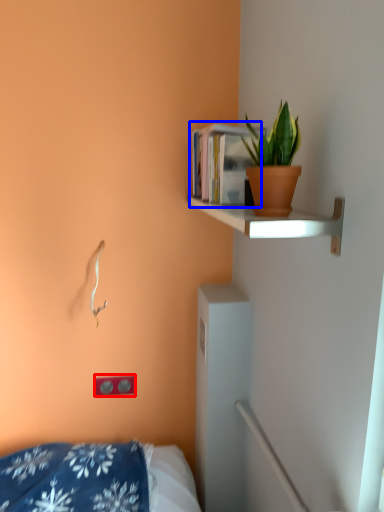
Question: Which of the following is the farthest to the observer, electric outlet (highlighted by a red box) or book (highlighted by a blue box)?

Choices:
 (A) electric outlet
 (B) book

Answer: (A)